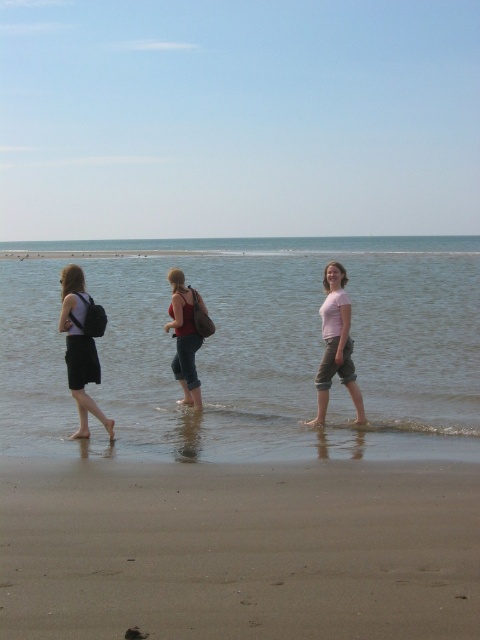
Who is positioned more to the right, brown sandy beach at lower center or matte black backpack at left?

brown sandy beach at lower center is more to the right.

In the scene shown: Is brown sandy beach at lower center bigger than matte black backpack at left?

Yes, brown sandy beach at lower center is bigger than matte black backpack at left.

Between point (284, 481) and point (82, 429), which one is positioned in front?

Point (284, 481)

Where is `brown sandy beach at lower center`? The width and height of the screenshot is (480, 640). brown sandy beach at lower center is located at coordinates (239, 548).

Does clear water at center have a greater height compared to brown sandy beach at lower center?

Correct, clear water at center is much taller as brown sandy beach at lower center.

What do you see at coordinates (252, 346) in the screenshot?
I see `clear water at center` at bounding box center [252, 346].

Is point (457, 422) farther from camera compared to point (71, 632)?

Yes, point (457, 422) is behind point (71, 632).

Identify the location of clear water at center. (252, 346).

Which is more to the right, pink cotton shirt at center or matte black tank top at center?

Positioned to the right is pink cotton shirt at center.

Describe the element at coordinates (336, 344) in the screenshot. I see `pink cotton shirt at center` at that location.

At what (x,y) coordinates should I click in order to perform the action: click on pink cotton shirt at center. Please return your answer as a coordinate pair (x, y). The height and width of the screenshot is (640, 480). Looking at the image, I should click on (336, 344).